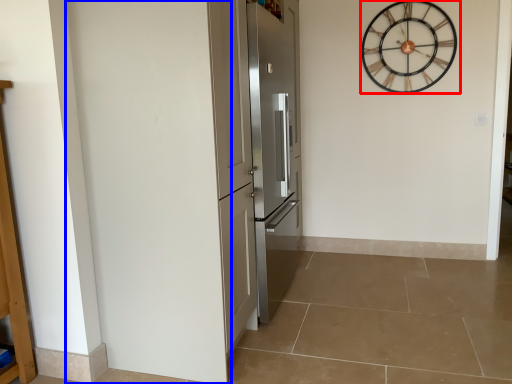
Question: Which point is closer to the camera, wall clock (highlighted by a red box) or door (highlighted by a blue box)?

Choices:
 (A) wall clock
 (B) door

Answer: (B)